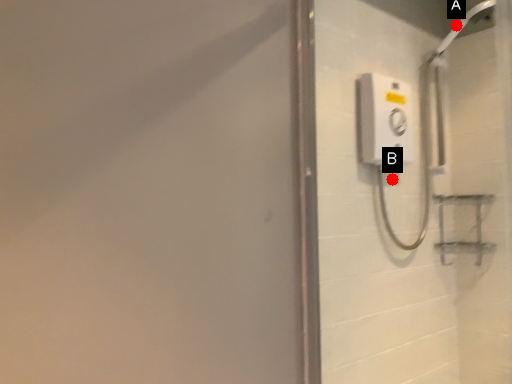
Question: Two points are circled on the image, labeled by A and B beside each circle. Which point appears closest to the camera in this image?

Choices:
 (A) A is closer
 (B) B is closer

Answer: (B)